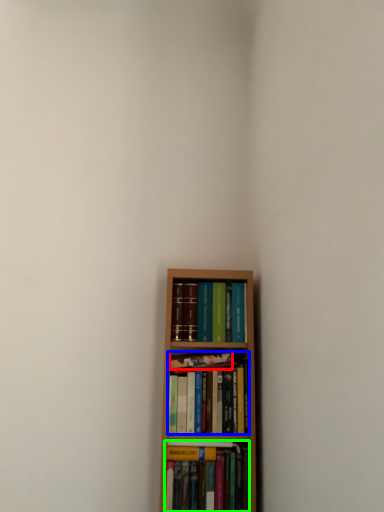
Question: Which is nearer to the book (highlighted by a red box)? book (highlighted by a blue box) or book (highlighted by a green box).

Choices:
 (A) book
 (B) book

Answer: (A)